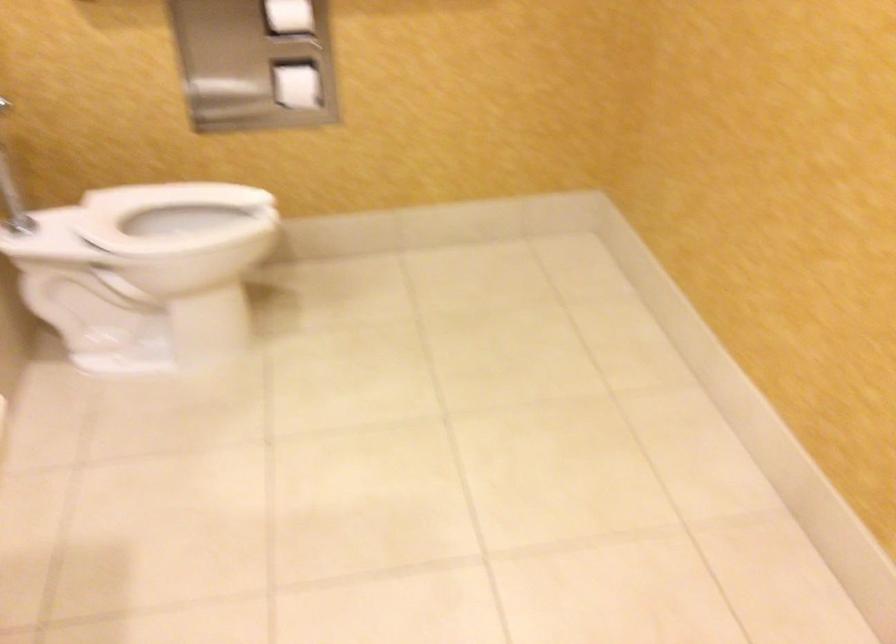
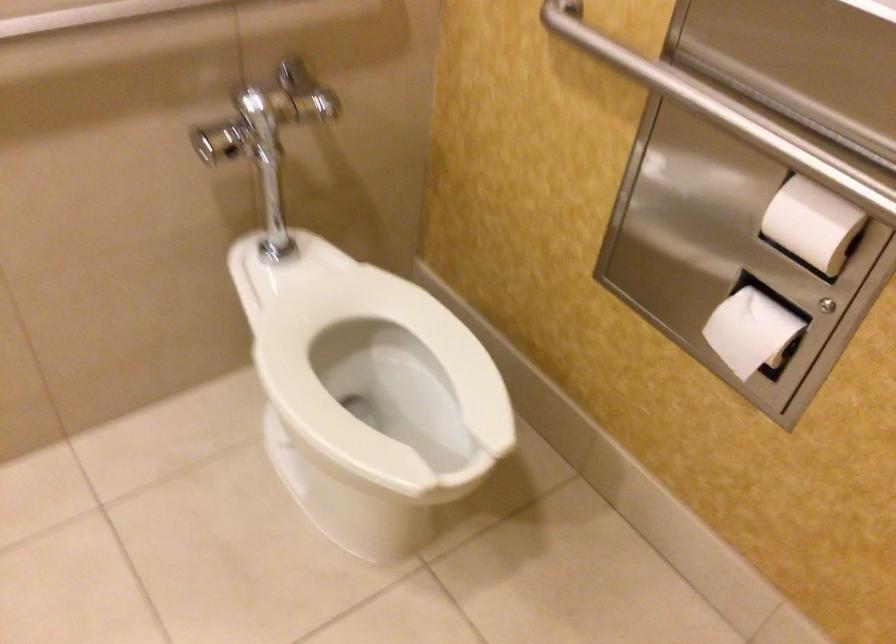
Locate, in the second image, the point that corresponds to (306,82) in the first image.

(751, 330)